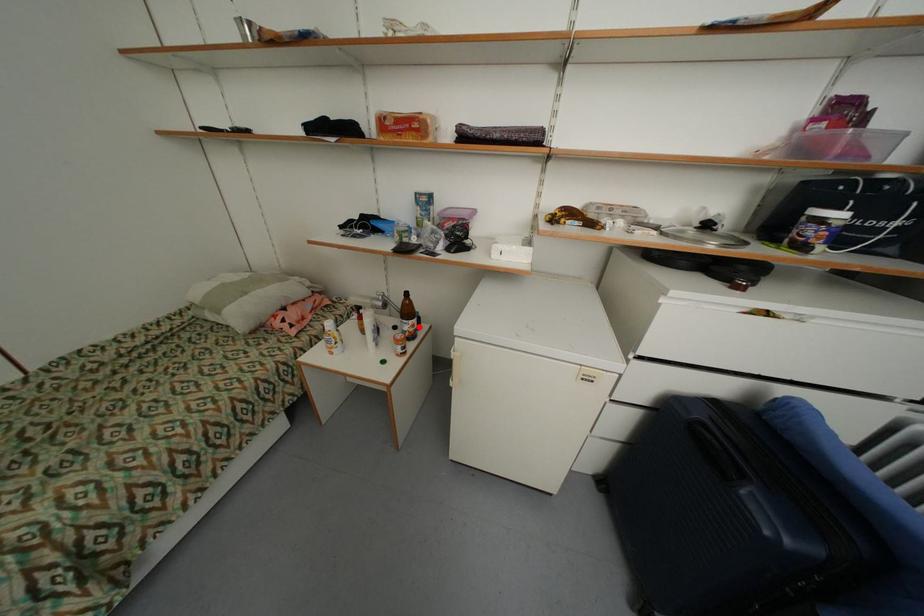
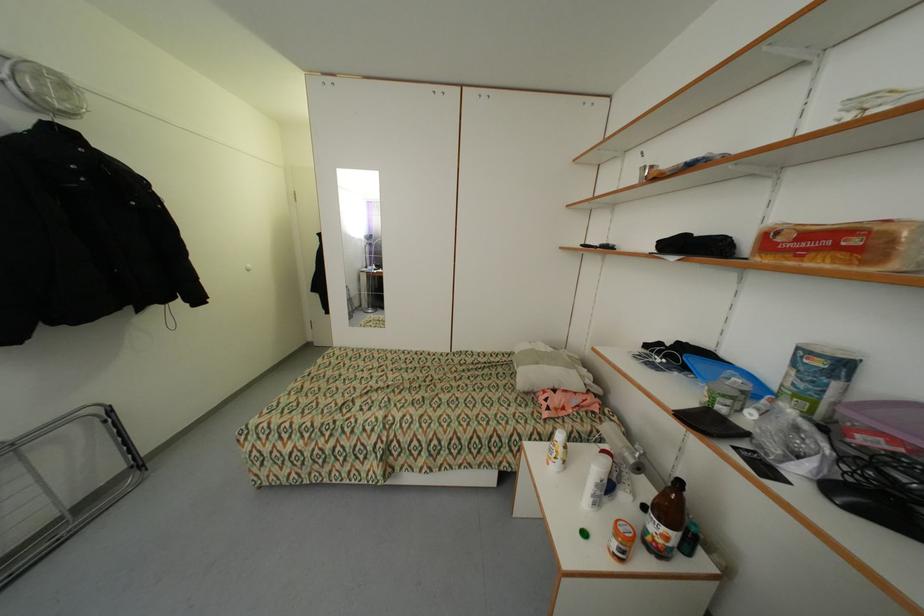
Where in the second image is the point corresponding to the highlighted location from the first image?

(673, 540)